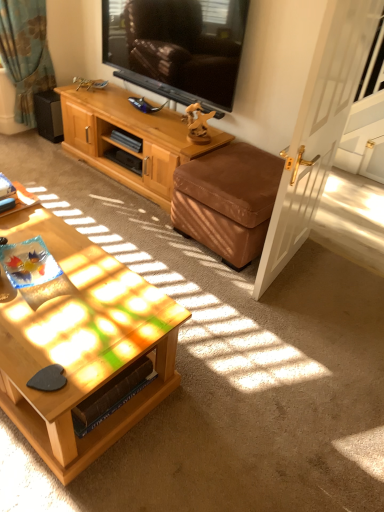
This screenshot has height=512, width=384. In order to click on free space in front of light brown wood cabinet at upper center in this screenshot , I will do `click(141, 228)`.